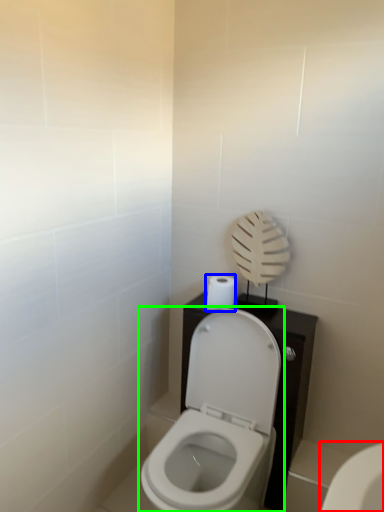
Question: Based on their relative distances, which object is farther from toilet (highlighted by a red box)? Choose from toilet paper (highlighted by a blue box) and toilet (highlighted by a green box).

Choices:
 (A) toilet paper
 (B) toilet

Answer: (A)